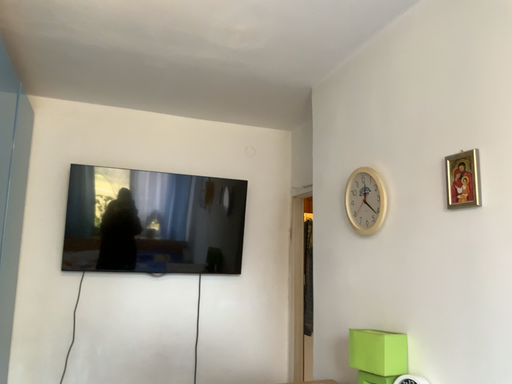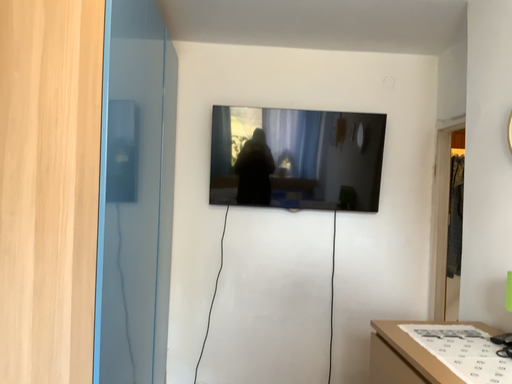
Question: Which way did the camera rotate in the video?

Choices:
 (A) rotated right
 (B) rotated left

Answer: (B)